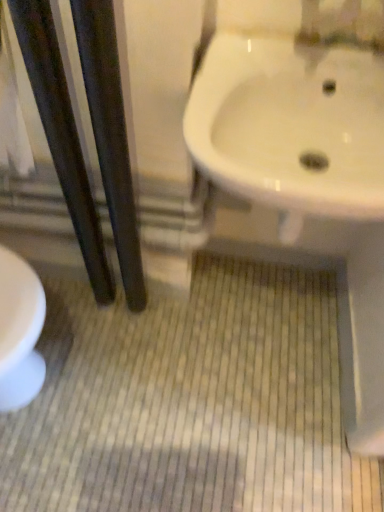
Question: From the image's perspective, is dark wood pole at left, marked as the first pole in a left-to-right arrangement, positioned above or below white glossy sink at upper right?

Choices:
 (A) above
 (B) below

Answer: (B)

Question: Visually, is dark wood pole at left, marked as the first pole in a left-to-right arrangement, positioned to the left or to the right of white glossy sink at upper right?

Choices:
 (A) left
 (B) right

Answer: (A)

Question: Which is farther from the white glossy sink at upper right?

Choices:
 (A) black glossy poles at left, which appears as the second pole when viewed from the left
 (B) dark wood pole at left, acting as the second pole starting from the right

Answer: (B)

Question: Estimate the real-world distances between objects in this image. Which object is farther from the dark wood pole at left, marked as the first pole in a left-to-right arrangement?

Choices:
 (A) black glossy poles at left, which appears as the second pole when viewed from the left
 (B) white glossy sink at upper right

Answer: (B)